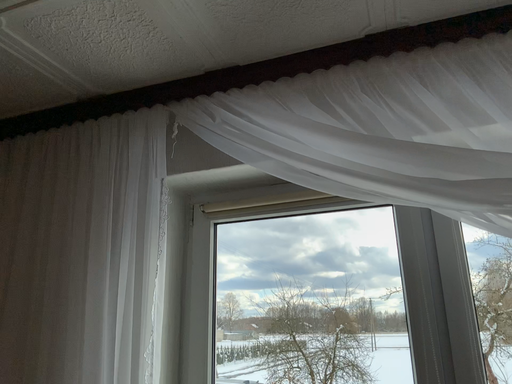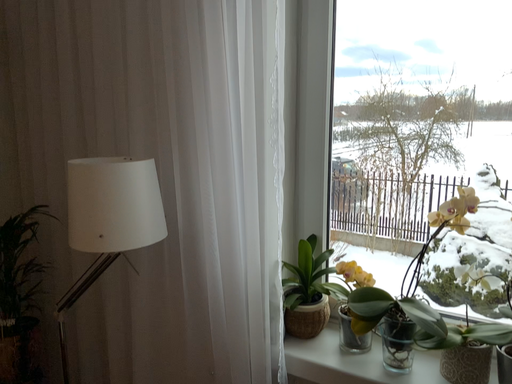
Question: Which way did the camera rotate in the video?

Choices:
 (A) rotated left
 (B) rotated right

Answer: (A)